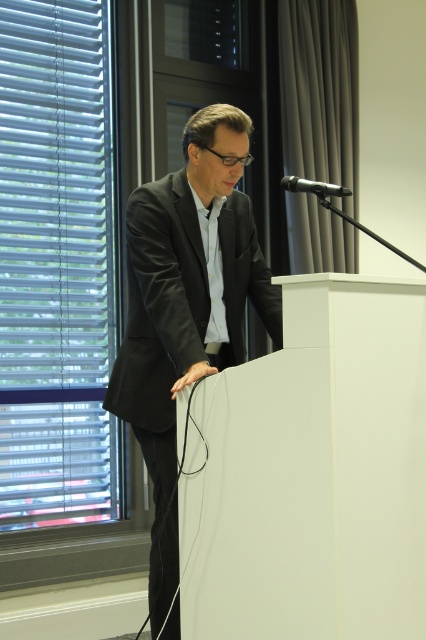
Consider the image. Is matte black suit at center positioned at the back of black metallic microphone at upper center?

Yes, it is behind black metallic microphone at upper center.

Is point (189, 296) more distant than point (322, 184)?

Yes, it is.

Is point (264, 301) closer to viewer compared to point (293, 192)?

Yes, point (264, 301) is in front of point (293, 192).

Locate an element on the screen. The image size is (426, 640). matte black suit at center is located at coordinates (187, 307).